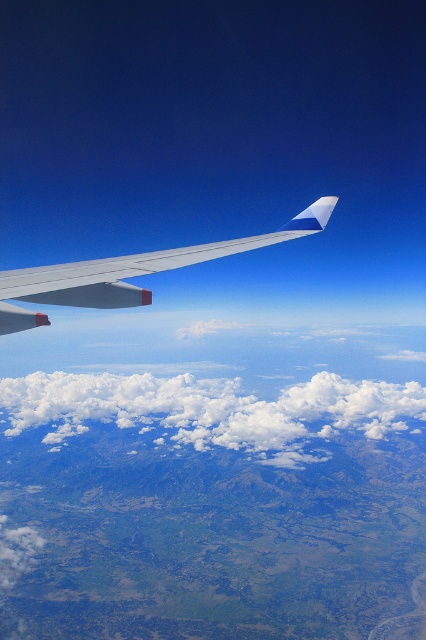
Which is more to the right, white fluffy cloud at center or white fluffy cloud at lower left?

From the viewer's perspective, white fluffy cloud at center appears more on the right side.

The image size is (426, 640). What do you see at coordinates (212, 410) in the screenshot?
I see `white fluffy cloud at center` at bounding box center [212, 410].

Is point (8, 378) positioned in front of point (11, 556)?

No.

This screenshot has width=426, height=640. What are the coordinates of `white fluffy cloud at center` in the screenshot? It's located at (212, 410).

Who is positioned more to the left, white fluffy cloud at center or silver metallic wing at upper center?

white fluffy cloud at center is more to the left.

Is point (313, 410) behind point (244, 241)?

Yes, it is behind point (244, 241).

I want to click on white fluffy cloud at center, so click(x=212, y=410).

Between silver metallic wing at upper center and white fluffy cloud at lower left, which one appears on the left side from the viewer's perspective?

white fluffy cloud at lower left

Is silver metallic wing at upper center smaller than white fluffy cloud at lower left?

Yes, silver metallic wing at upper center is smaller than white fluffy cloud at lower left.

Is point (3, 307) closer to camera compared to point (0, 573)?

Yes.

I want to click on silver metallic wing at upper center, so click(x=140, y=266).